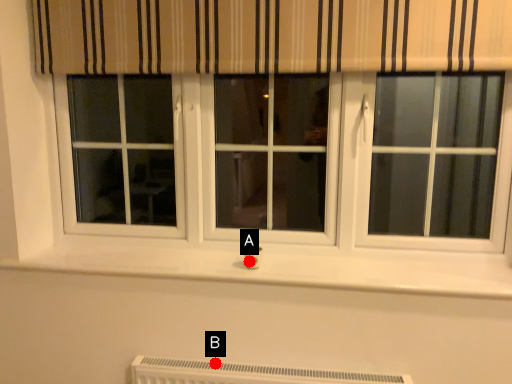
Question: Two points are circled on the image, labeled by A and B beside each circle. Which point is closer to the camera taking this photo?

Choices:
 (A) A is closer
 (B) B is closer

Answer: (B)